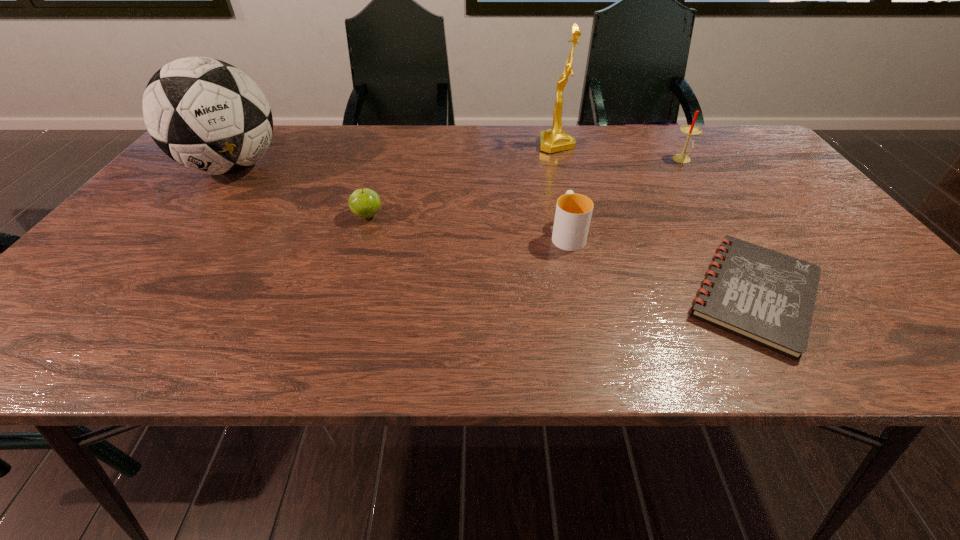
At what (x,y) coordinates should I click in order to perform the action: click on the fifth closest object to the candle. Please return your answer as a coordinate pair (x, y). This screenshot has width=960, height=540. Looking at the image, I should click on (207, 115).

Identify the location of object that ranks as the fifth closest to the apple. click(x=690, y=130).

The width and height of the screenshot is (960, 540). I want to click on vacant space that satisfies the following two spatial constraints: 1. on the front-facing side of the award; 2. on the right side of the notebook, so click(x=595, y=294).

Image resolution: width=960 pixels, height=540 pixels. Identify the location of vacant space that satisfies the following two spatial constraints: 1. on the front-facing side of the notebook; 2. on the left side of the award. (595, 294).

I want to click on free space that satisfies the following two spatial constraints: 1. with the handle on the side of the third shortest object; 2. on the left side of the fourth shortest object, so click(551, 160).

At what (x,y) coordinates should I click in order to perform the action: click on vacant region that satisfies the following two spatial constraints: 1. with the handle on the side of the cup; 2. on the left side of the fourth shortest object. Please return your answer as a coordinate pair (x, y). This screenshot has width=960, height=540. Looking at the image, I should click on (551, 160).

What are the coordinates of `blank area in the image that satisfies the following two spatial constraints: 1. with the handle on the side of the third tallest object; 2. on the right side of the third shortest object` in the screenshot? It's located at (551, 160).

You are a GUI agent. You are given a task and a screenshot of the screen. Output one action in this format:
    pyautogui.click(x=<x>, y=<y>)
    Task: Click on the free location that satisfies the following two spatial constraints: 1. on the front side of the fifth object from right to left; 2. on the right side of the shortest object
    The width and height of the screenshot is (960, 540).
    Given the screenshot: What is the action you would take?
    pyautogui.click(x=344, y=294)